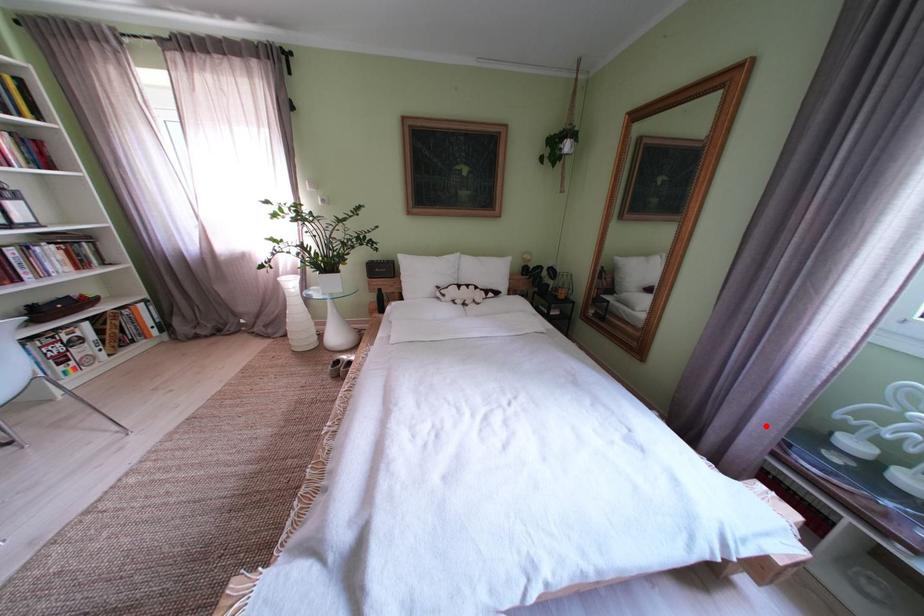
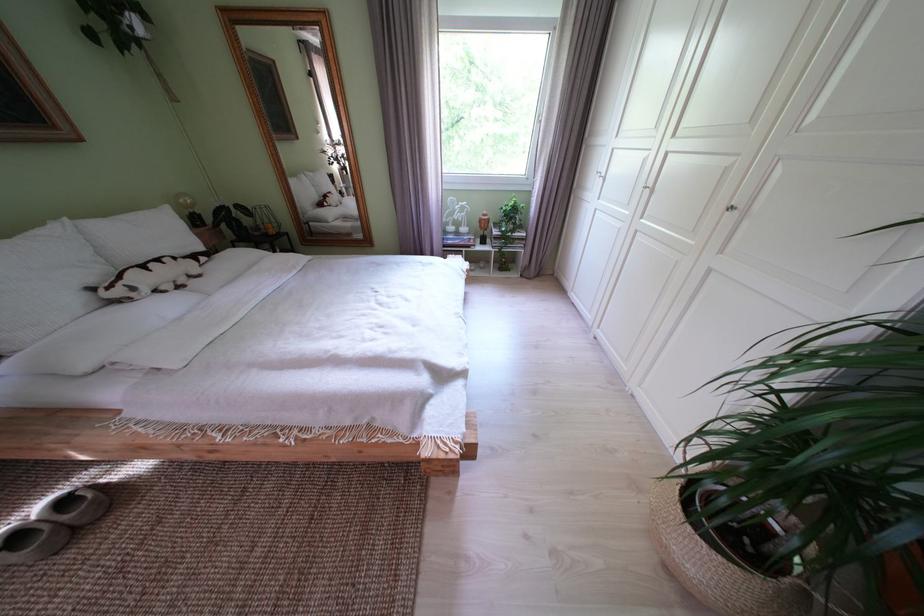
Question: I am providing you with two images of the same scene from different viewpoints. A red point is shown in image1. For the corresponding object point in image2, is it positioned nearer or farther from the camera?

Choices:
 (A) Nearer
 (B) Farther

Answer: (A)